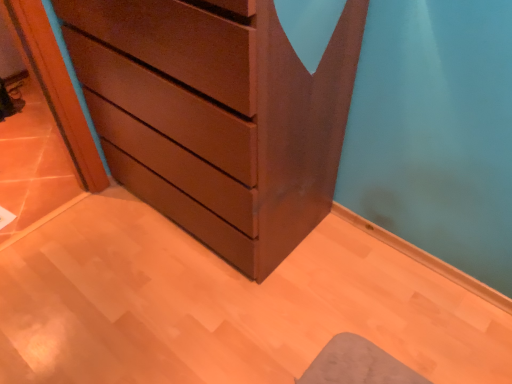
Measure the distance between point (x=278, y=169) and camera.

3.98 feet.

Where is `matte brown chest of drawers at center`? This screenshot has height=384, width=512. matte brown chest of drawers at center is located at coordinates (217, 116).

Describe the element at coordinates (217, 116) in the screenshot. I see `matte brown chest of drawers at center` at that location.

This screenshot has width=512, height=384. I want to click on matte brown chest of drawers at center, so click(x=217, y=116).